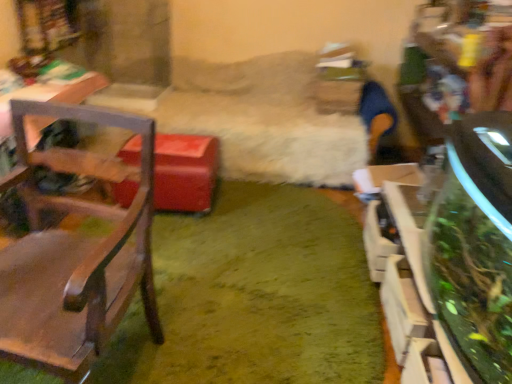
The width and height of the screenshot is (512, 384). Describe the element at coordinates (255, 296) in the screenshot. I see `green plush carpet at center` at that location.

Locate an element on the screen. The image size is (512, 384). green plush carpet at center is located at coordinates (255, 296).

Identify the location of green plush carpet at center. This screenshot has height=384, width=512. (255, 296).

Is green plush carpet at center not close to green leafy plant at right?

They are positioned close to each other.

Is green plush carpet at center positioned with its back to green leafy plant at right?

No, green leafy plant at right is not at the back of green plush carpet at center.

Which is behind, point (184, 274) or point (430, 272)?

The point (184, 274) is farther from the camera.

From the picture: Can we say green leafy plant at right lies outside wooden chair at left?

Yes, green leafy plant at right is not within wooden chair at left.

In terms of height, does green leafy plant at right look taller or shorter compared to wooden chair at left?

green leafy plant at right is shorter than wooden chair at left.

Considering the sizes of green leafy plant at right and wooden chair at left in the image, is green leafy plant at right bigger or smaller than wooden chair at left?

Considering their sizes, green leafy plant at right takes up less space than wooden chair at left.

At what (x,y) coordinates should I click in order to perform the action: click on plant below the wooden chair at left (from a real-world perspective). Please return your answer as a coordinate pair (x, y). Looking at the image, I should click on (470, 282).

Consider the image. From a real-world perspective, is wooden chair at left above or below green plush carpet at center?

wooden chair at left is above green plush carpet at center.

Is wooden chair at left taller than green plush carpet at center?

Yes, wooden chair at left is taller than green plush carpet at center.

Identify the location of grass below the wooden chair at left (from the image's perspective). The image size is (512, 384). (255, 296).

Based on the photo, is green plush carpet at center a part of wooden chair at left?

No, green plush carpet at center is not a part of wooden chair at left.

From a real-world perspective, does green plush carpet at center sit lower than wooden chair at left?

Correct, in the physical world, green plush carpet at center is lower than wooden chair at left.

In order to click on grass that is below the wooden chair at left (from the image's perspective) in this screenshot , I will do `click(255, 296)`.

Is point (262, 330) closer to viewer compared to point (93, 254)?

No, it is behind (93, 254).

Is green plush carpet at center next to wooden chair at left?

No, green plush carpet at center is not making contact with wooden chair at left.

In terms of width, does wooden chair at left look wider or thinner when compared to green leafy plant at right?

wooden chair at left is wider than green leafy plant at right.

Considering the relative positions of wooden chair at left and green leafy plant at right in the image provided, is wooden chair at left to the left or to the right of green leafy plant at right?

wooden chair at left is to the left of green leafy plant at right.

From a real-world perspective, relative to green leafy plant at right, is wooden chair at left vertically above or below?

From a real-world perspective, wooden chair at left is physically above green leafy plant at right.

What's the angular difference between wooden chair at left and green leafy plant at right's facing directions?

The angular difference between wooden chair at left and green leafy plant at right is 79.7 degrees.

At what (x,y) coordinates should I click in order to perform the action: click on grass behind the green leafy plant at right. Please return your answer as a coordinate pair (x, y). The width and height of the screenshot is (512, 384). Looking at the image, I should click on (255, 296).

Considering the sizes of objects green leafy plant at right and green plush carpet at center in the image provided, who is shorter, green leafy plant at right or green plush carpet at center?

green plush carpet at center.

Is green leafy plant at right bigger or smaller than green plush carpet at center?

green leafy plant at right is bigger than green plush carpet at center.

At what (x,y) coordinates should I click in order to perform the action: click on plant on the right of green plush carpet at center. Please return your answer as a coordinate pair (x, y). This screenshot has height=384, width=512. Looking at the image, I should click on (470, 282).

I want to click on plant below the wooden chair at left (from a real-world perspective), so click(470, 282).

Considering their positions, is wooden chair at left positioned closer to green leafy plant at right than green plush carpet at center?

The object closer to green leafy plant at right is green plush carpet at center.

Looking at the image, which one is located closer to green leafy plant at right, green plush carpet at center or wooden chair at left?

green plush carpet at center is positioned closer to the anchor green leafy plant at right.

Looking at the image, which one is located closer to green plush carpet at center, green leafy plant at right or wooden chair at left?

wooden chair at left is positioned closer to the anchor green plush carpet at center.

Estimate the real-world distances between objects in this image. Which object is further from wooden chair at left, green plush carpet at center or green leafy plant at right?

green leafy plant at right.

Which object lies nearer to the anchor point green plush carpet at center, wooden chair at left or green leafy plant at right?

wooden chair at left is closer to green plush carpet at center.

Estimate the real-world distances between objects in this image. Which object is further from wooden chair at left, green leafy plant at right or green plush carpet at center?

The object further to wooden chair at left is green leafy plant at right.

You are a GUI agent. You are given a task and a screenshot of the screen. Output one action in this format:
    pyautogui.click(x=<x>, y=<y>)
    Task: Click on the grass between wooden chair at left and green leafy plant at right
    The image size is (512, 384).
    Given the screenshot: What is the action you would take?
    pyautogui.click(x=255, y=296)